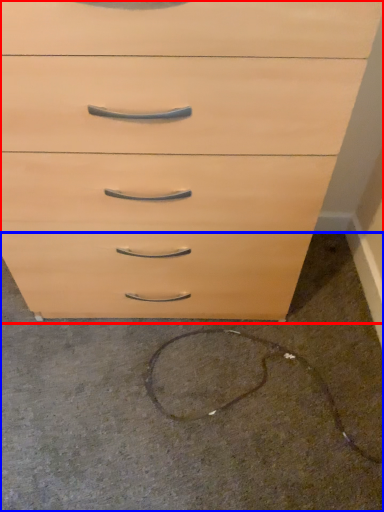
Question: Which of the following is the closest to the observer, chest of drawers (highlighted by a red box) or concrete (highlighted by a blue box)?

Choices:
 (A) chest of drawers
 (B) concrete

Answer: (A)